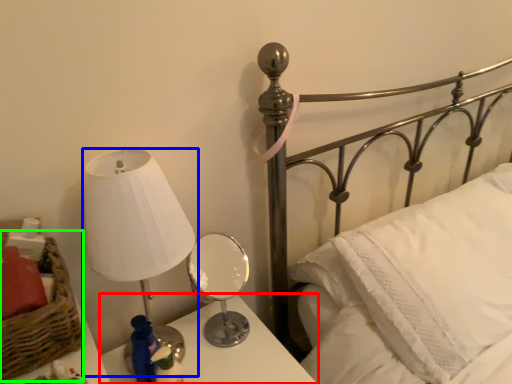
Question: Which object is the farthest from nightstand (highlighted by a red box)? Choose among these: lamp (highlighted by a blue box) or basket (highlighted by a green box).

Choices:
 (A) lamp
 (B) basket

Answer: (B)